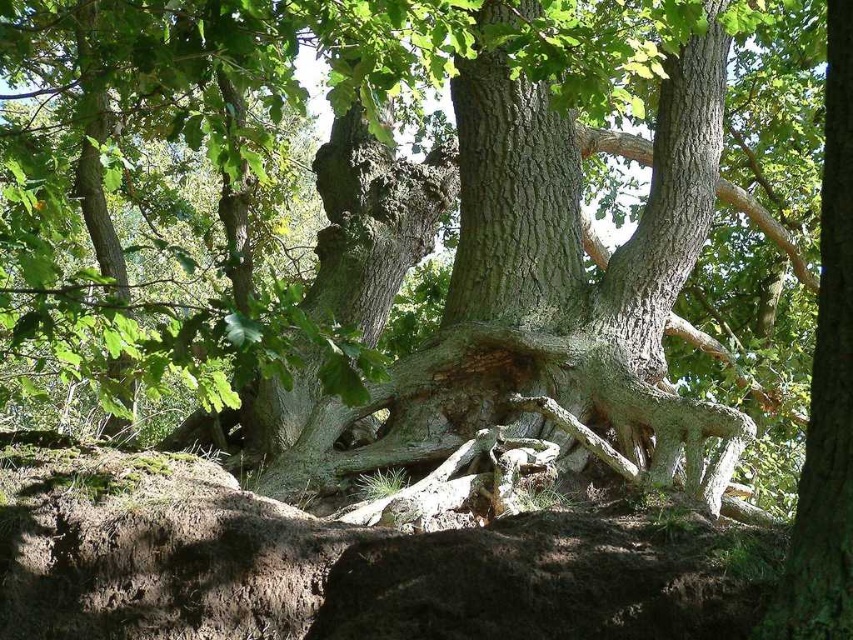
You are standing at the base of the ancient oak tree and notice a point marked at coordinates (331,563). According to the image description, what object is located at that point?

The brown rough rock at lower center is located at point (331,563).